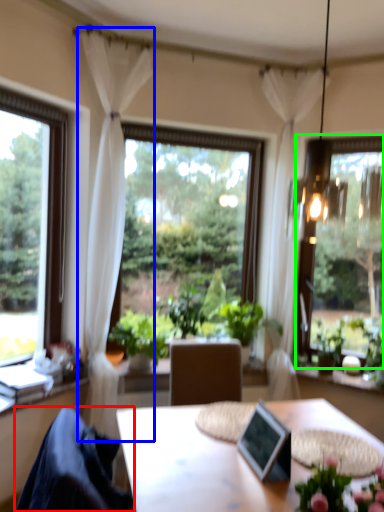
Question: Estimate the real-world distances between objects in this image. Which object is closer to chair (highlighted by a red box), curtain (highlighted by a blue box) or window (highlighted by a green box)?

Choices:
 (A) curtain
 (B) window

Answer: (A)